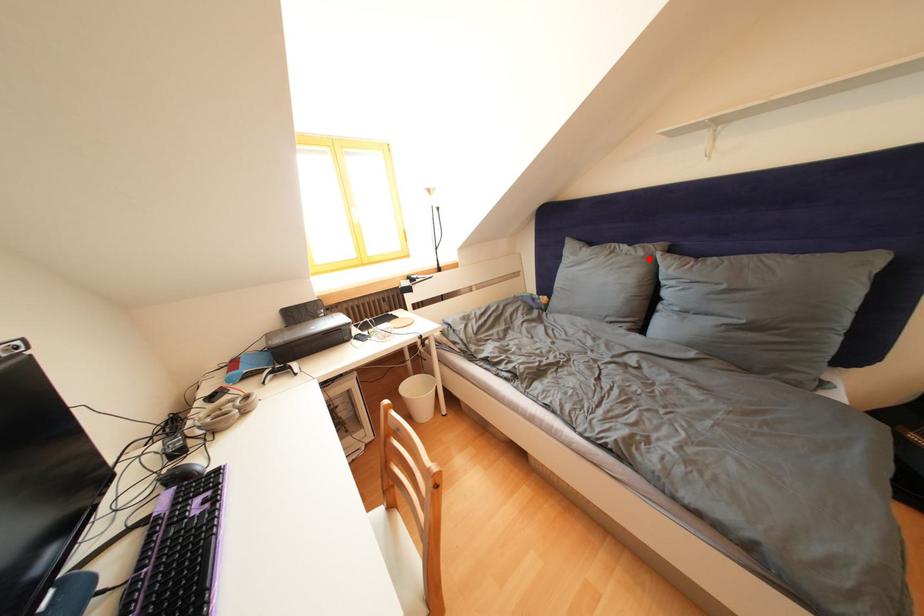
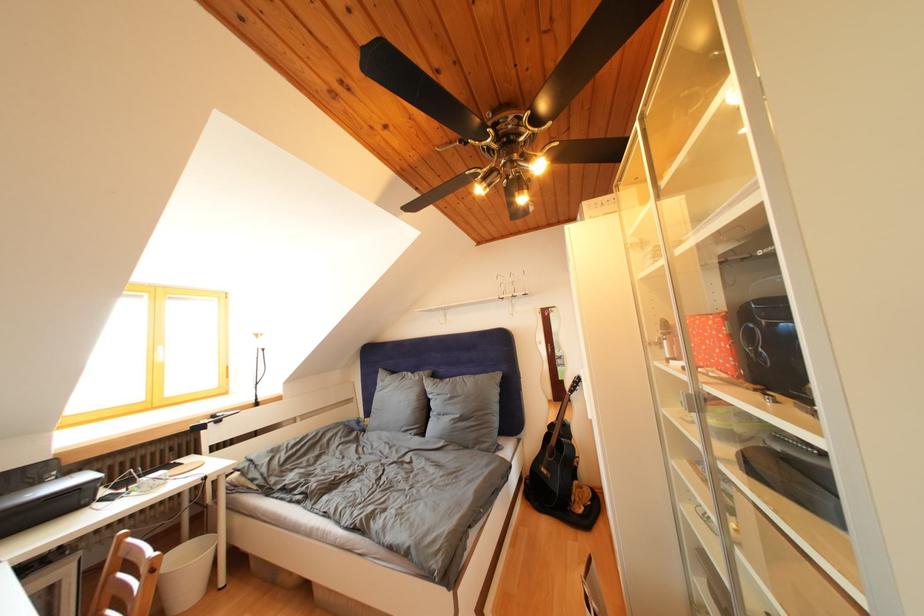
Find the pixel in the second image that matches the highlighted location in the first image.

(426, 383)